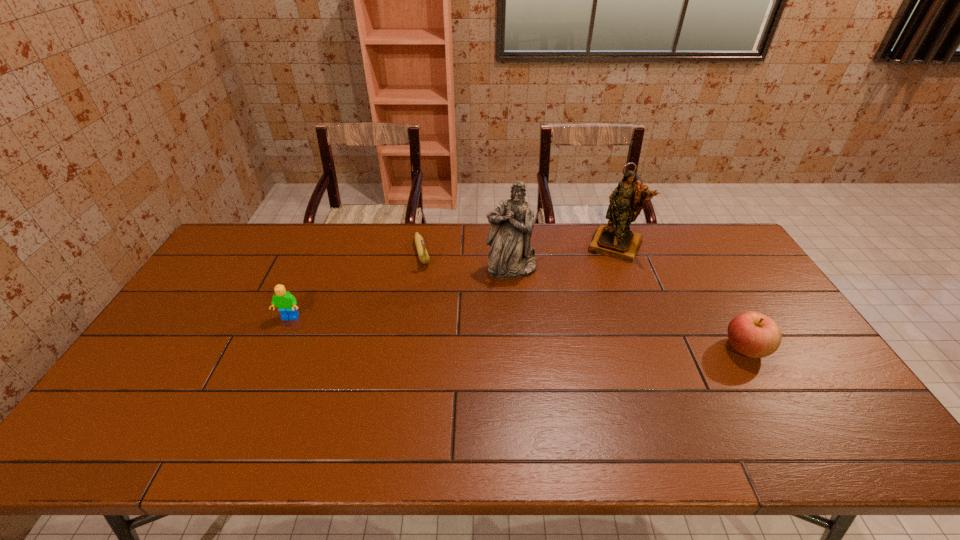
What are the coordinates of `vacant area between the second nearest object and the fourth object from left to right` in the screenshot? It's located at (452, 281).

You are a GUI agent. You are given a task and a screenshot of the screen. Output one action in this format:
    pyautogui.click(x=<x>, y=<y>)
    Task: Click on the object that stands as the fourth closest to the rightmost object
    The width and height of the screenshot is (960, 540).
    Given the screenshot: What is the action you would take?
    pyautogui.click(x=284, y=300)

Point out which object is positioned as the second nearest to the third object from left to right. Please provide its 2D coordinates. Your answer should be formatted as a tuple, i.e. [(x, y)], where the tuple contains the x and y coordinates of a point satisfying the conditions above.

[(616, 240)]

Locate an element on the screen. free space that satisfies the following two spatial constraints: 1. on the face of the leftmost object; 2. on the left side of the rightmost object is located at coordinates (276, 348).